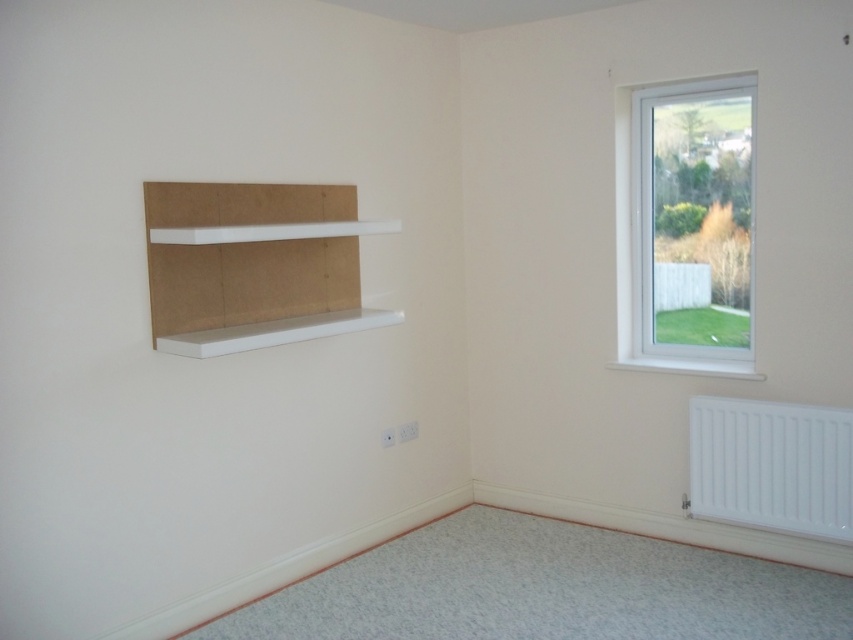
Question: Based on their relative distances, which object is nearer to the white plastic window at upper right?

Choices:
 (A) white cardboard bookshelf at left
 (B) white metallic radiator at lower right

Answer: (B)

Question: Can you confirm if white plastic window at upper right is positioned below white cardboard bookshelf at left?

Choices:
 (A) no
 (B) yes

Answer: (A)

Question: Is white plastic window at upper right bigger than white metallic radiator at lower right?

Choices:
 (A) yes
 (B) no

Answer: (A)

Question: Considering the real-world distances, which object is closest to the white plastic window at upper right?

Choices:
 (A) white metallic radiator at lower right
 (B) white cardboard bookshelf at left

Answer: (A)

Question: Can you confirm if white cardboard bookshelf at left is thinner than white metallic radiator at lower right?

Choices:
 (A) yes
 (B) no

Answer: (B)

Question: Which point is closer to the camera?

Choices:
 (A) (844, 433)
 (B) (749, 81)

Answer: (A)